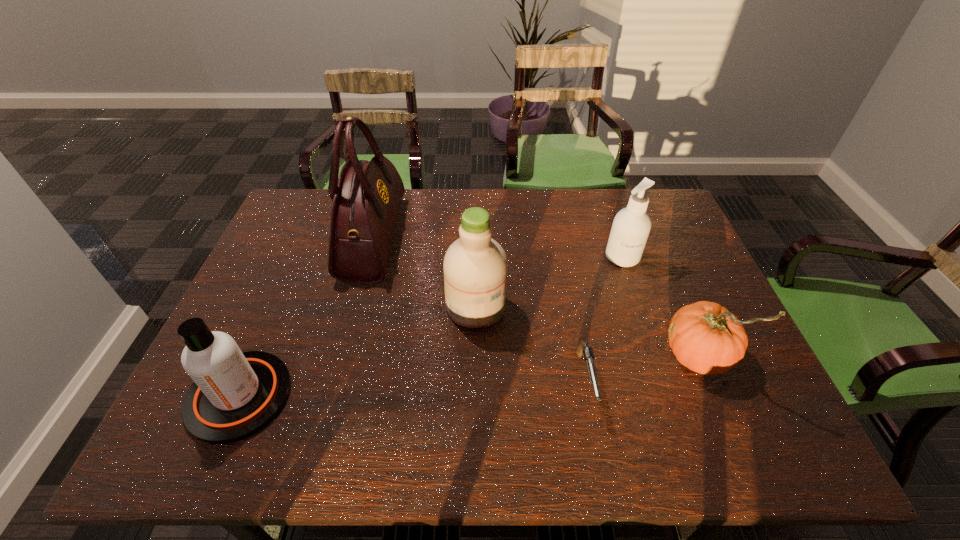
Locate an element on the screen. This screenshot has height=540, width=960. blank region between the handbag and the second cleansing agent from left to right is located at coordinates (424, 272).

The width and height of the screenshot is (960, 540). What are the coordinates of `vacant area that lies between the farthest cleansing agent and the third object from right to left` in the screenshot? It's located at (604, 318).

What are the coordinates of `vacant area that lies between the third object from left to right and the shortest object` in the screenshot? It's located at (531, 343).

Where is `free area in between the pumpkin and the third object from right to left`? This screenshot has width=960, height=540. free area in between the pumpkin and the third object from right to left is located at coordinates (642, 366).

Point out which object is positioned as the second nearest to the leftmost cleansing agent. Please provide its 2D coordinates. Your answer should be formatted as a tuple, i.e. [(x, y)], where the tuple contains the x and y coordinates of a point satisfying the conditions above.

[(475, 266)]

Choose which object is the second nearest neighbor to the leftmost cleansing agent. Please provide its 2D coordinates. Your answer should be formatted as a tuple, i.e. [(x, y)], where the tuple contains the x and y coordinates of a point satisfying the conditions above.

[(475, 266)]

Select which cleansing agent is the closest to the third object from left to right. Please provide its 2D coordinates. Your answer should be formatted as a tuple, i.e. [(x, y)], where the tuple contains the x and y coordinates of a point satisfying the conditions above.

[(631, 226)]

This screenshot has height=540, width=960. What are the coordinates of `cleansing agent that can be found as the second closest to the third object from left to right` in the screenshot? It's located at 235,394.

Locate an element on the screen. The width and height of the screenshot is (960, 540). free space that satisfies the following two spatial constraints: 1. on the front-facing side of the handbag; 2. on the front side of the leftmost object is located at coordinates (331, 396).

Where is `free region that satisfies the following two spatial constraints: 1. on the front label of the second cleansing agent from left to right; 2. on the left side of the pumpkin`? free region that satisfies the following two spatial constraints: 1. on the front label of the second cleansing agent from left to right; 2. on the left side of the pumpkin is located at coordinates (475, 353).